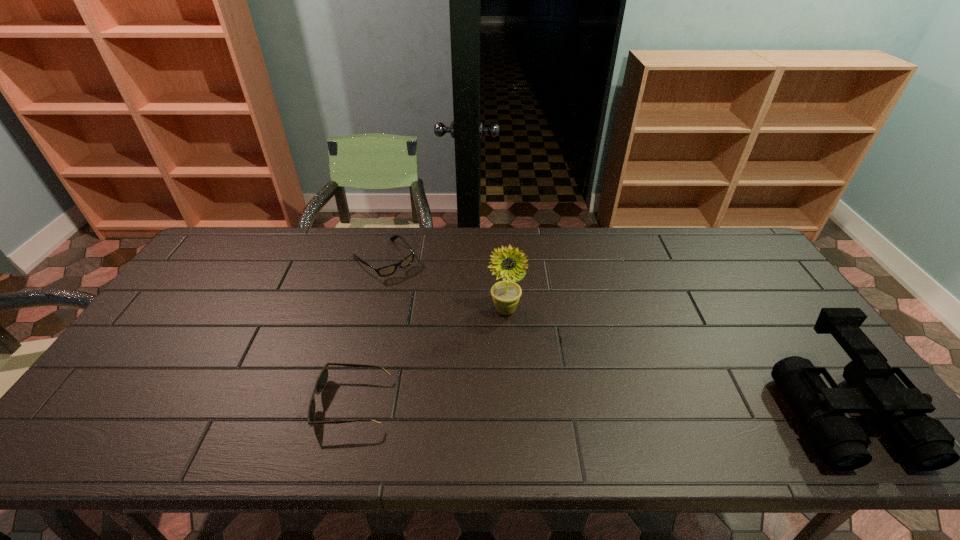
You are a GUI agent. You are given a task and a screenshot of the screen. Output one action in this format:
    pyautogui.click(x=<x>, y=<y>)
    Task: Click on the free space at the far edge of the desktop
    The height and width of the screenshot is (540, 960).
    Given the screenshot: What is the action you would take?
    point(327,239)

Identify the location of vacant space at the near edge of the desktop. The image size is (960, 540). (584, 384).

Where is `free point at the near left corner`? The image size is (960, 540). free point at the near left corner is located at coordinates (103, 405).

Where is `vacant space at the far right corner`? The image size is (960, 540). vacant space at the far right corner is located at coordinates (739, 237).

Identify the location of empty space that is in between the sunglasses and the second object from right to left. The height and width of the screenshot is (540, 960). (429, 356).

Where is `empty space between the spectacles and the third shortest object`? This screenshot has width=960, height=540. empty space between the spectacles and the third shortest object is located at coordinates (612, 335).

You are a GUI agent. You are given a task and a screenshot of the screen. Output one action in this format:
    pyautogui.click(x=<x>, y=<y>)
    Task: Click on the free space between the sunglasses and the second object from right to left
    
    Given the screenshot: What is the action you would take?
    pyautogui.click(x=429, y=356)

Image resolution: width=960 pixels, height=540 pixels. What are the coordinates of `free spot between the binoculars and the sunflower` in the screenshot? It's located at (672, 360).

At what (x,y) coordinates should I click in order to perform the action: click on vacant space in between the spectacles and the sunglasses. Please return your answer as a coordinate pair (x, y). The width and height of the screenshot is (960, 540). Looking at the image, I should click on (368, 331).

The width and height of the screenshot is (960, 540). Find the location of `vacant space in between the second object from right to left and the binoculars`. vacant space in between the second object from right to left and the binoculars is located at coordinates (672, 360).